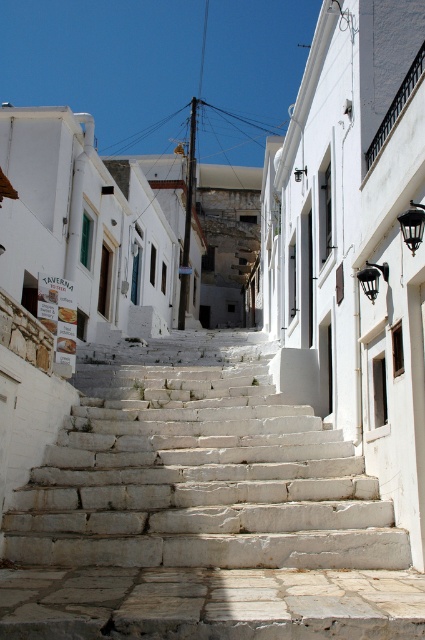
Is white stone stairs at center taller than black metal balustrade at upper right?

Yes.

Is point (258, 499) closer to camera compared to point (413, 77)?

Yes, it is.

Identify the location of white stone stairs at center. (198, 468).